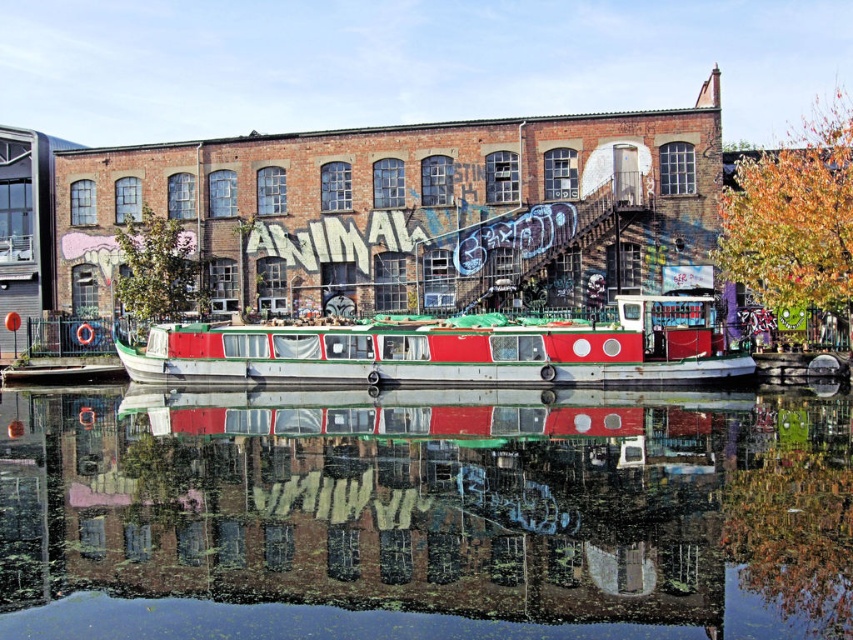
Question: Can you confirm if green reflective water at center is positioned to the left of white glossy barge at center?

Choices:
 (A) no
 (B) yes

Answer: (B)

Question: Which point is farther from the camera taking this photo?

Choices:
 (A) (61, 451)
 (B) (669, 365)

Answer: (B)

Question: Observing the image, what is the correct spatial positioning of green reflective water at center in reference to white glossy barge at center?

Choices:
 (A) right
 (B) left

Answer: (B)

Question: Does green reflective water at center come in front of white glossy barge at center?

Choices:
 (A) yes
 (B) no

Answer: (A)

Question: Which object appears farthest from the camera in this image?

Choices:
 (A) white glossy barge at center
 (B) green reflective water at center

Answer: (A)